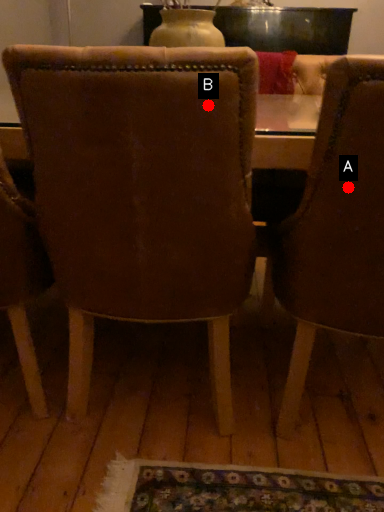
Question: Two points are circled on the image, labeled by A and B beside each circle. Which point is farther from the camera taking this photo?

Choices:
 (A) A is further
 (B) B is further

Answer: (A)